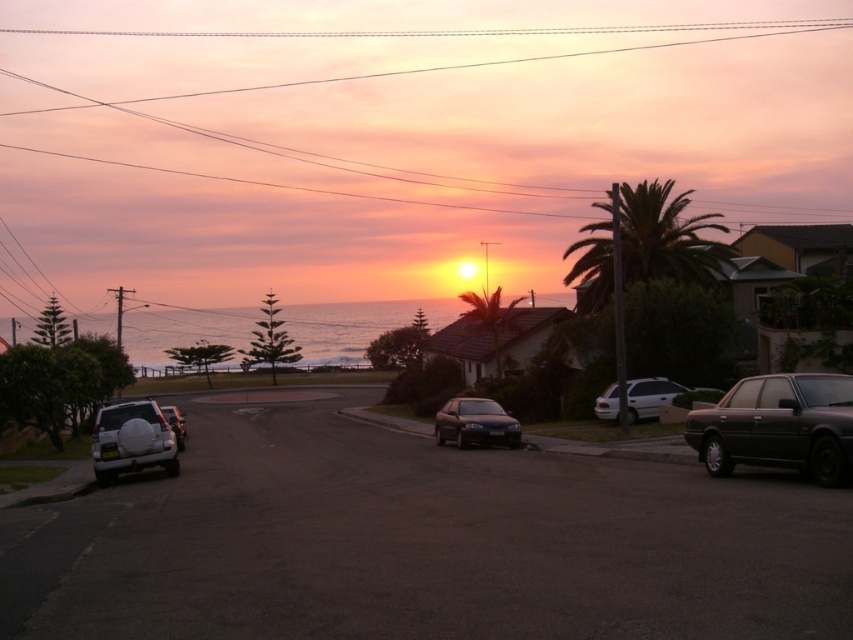
Does white matte suv at lower left appear over green leafy palm tree at center?

Actually, white matte suv at lower left is below green leafy palm tree at center.

Is point (100, 445) in front of point (491, 300)?

Yes, point (100, 445) is in front of point (491, 300).

Locate an element on the screen. This screenshot has height=640, width=853. white matte suv at lower left is located at coordinates (131, 440).

Does green leafy palm tree at center-right appear over green leafy palm tree at center?

Yes, green leafy palm tree at center-right is above green leafy palm tree at center.

Can you confirm if green leafy palm tree at center-right is bigger than green leafy palm tree at center?

Yes, green leafy palm tree at center-right is bigger than green leafy palm tree at center.

Is point (582, 269) behind point (494, 291)?

No, (582, 269) is in front of (494, 291).

Find the location of a particular element. The height and width of the screenshot is (640, 853). green leafy palm tree at center-right is located at coordinates (643, 241).

Is green leafy palm tree at center positioned behind white matte van at center-right?

Yes, it is.

Measure the distance between point (457, 296) and camera.

Point (457, 296) and camera are 239.32 meters apart from each other.

Identify the location of green leafy palm tree at center. This screenshot has height=640, width=853. (490, 320).